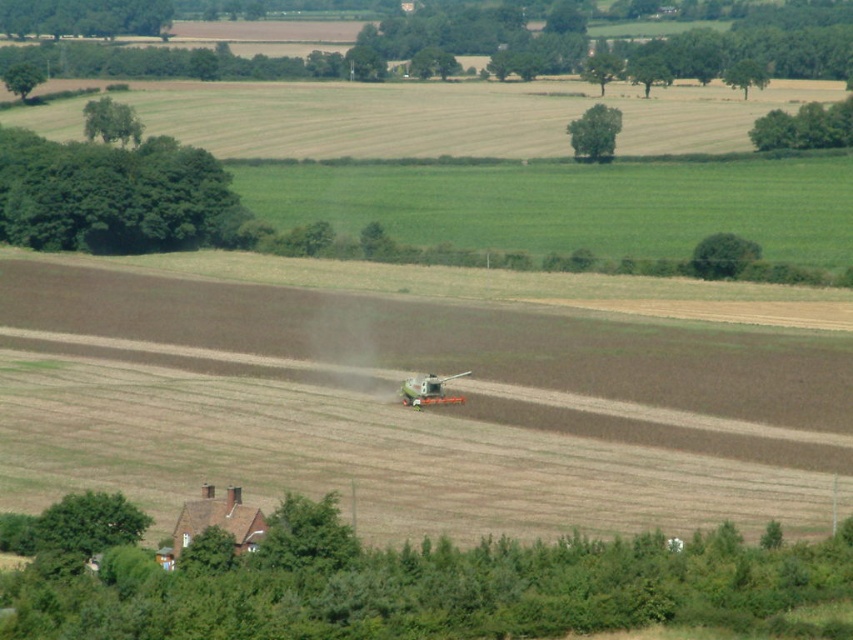
Question: Is brown soil at center above metallic orange agricultural equipment at center?

Choices:
 (A) yes
 (B) no

Answer: (A)

Question: Which point is closer to the camera taking this photo?

Choices:
 (A) (338, 372)
 (B) (399, 387)

Answer: (B)

Question: Does brown soil at center have a larger size compared to metallic orange agricultural equipment at center?

Choices:
 (A) no
 (B) yes

Answer: (B)

Question: Does brown soil at center appear under metallic orange agricultural equipment at center?

Choices:
 (A) yes
 (B) no

Answer: (B)